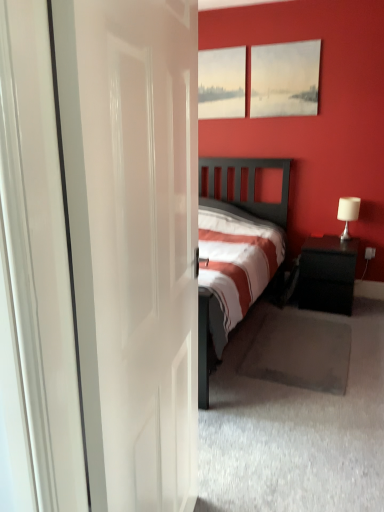
You are a GUI agent. You are given a task and a screenshot of the screen. Output one action in this format:
    pyautogui.click(x=<x>, y=<y>)
    Task: Click on the free space in front of black glossy nightstand at right
    Image resolution: width=384 pixels, height=512 pixels.
    Given the screenshot: What is the action you would take?
    pyautogui.click(x=341, y=324)